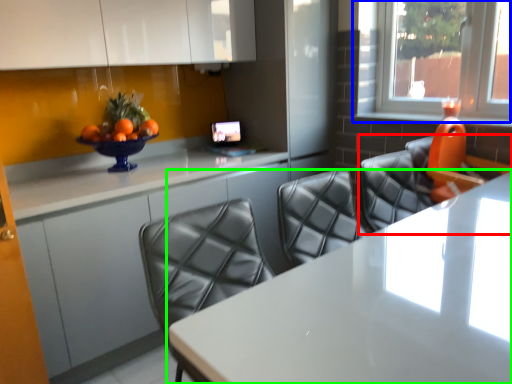
Question: Which is farther away from chair (highlighted by a red box)? window (highlighted by a blue box) or table (highlighted by a green box)?

Choices:
 (A) window
 (B) table

Answer: (A)